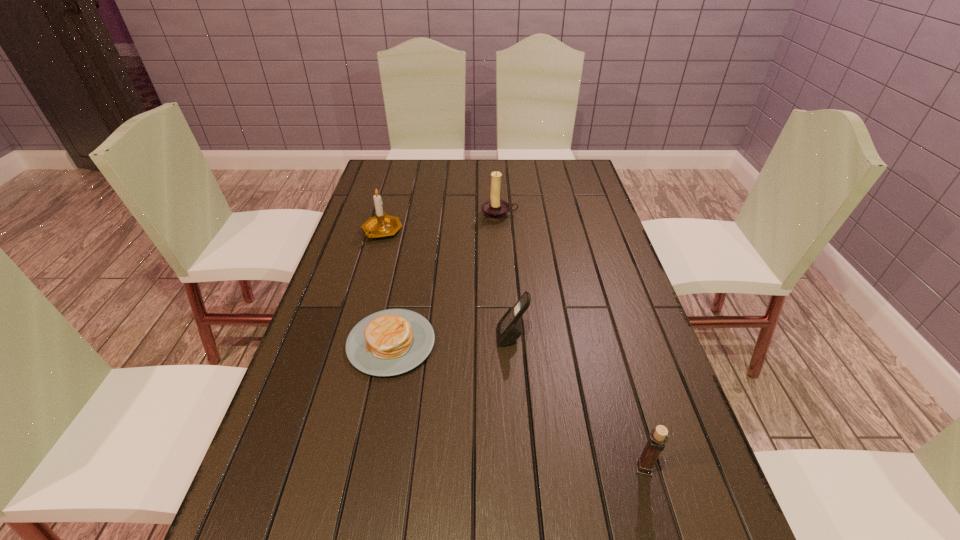
Where is `free area in between the cellular telephone and the rightmost candle holder`? The image size is (960, 540). free area in between the cellular telephone and the rightmost candle holder is located at coordinates (578, 402).

At what (x,y) coordinates should I click in order to perform the action: click on free spot between the shortest object and the rightmost candle holder. Please return your answer as a coordinate pair (x, y). Looking at the image, I should click on (517, 406).

At what (x,y) coordinates should I click in order to perform the action: click on empty space that is in between the second candle holder from left to right and the nearest object. Please return your answer as a coordinate pair (x, y). Looking at the image, I should click on coord(571,341).

Image resolution: width=960 pixels, height=540 pixels. I want to click on vacant space that is in between the pancake and the nearest object, so click(517, 406).

Image resolution: width=960 pixels, height=540 pixels. In order to click on free space between the pancake and the leftmost candle holder in this screenshot , I will do `click(387, 287)`.

Image resolution: width=960 pixels, height=540 pixels. In order to click on free space between the leftmost candle holder and the rightmost object in this screenshot , I will do `click(513, 350)`.

Choose which object is the fourth nearest neighbor to the cellular telephone. Please provide its 2D coordinates. Your answer should be formatted as a tuple, i.e. [(x, y)], where the tuple contains the x and y coordinates of a point satisfying the conditions above.

[(494, 209)]

Identify the location of object that is the third closest to the shortest object. The height and width of the screenshot is (540, 960). (494, 209).

Find the location of `candle holder that can be found as the closest to the rightmost object`. candle holder that can be found as the closest to the rightmost object is located at coordinates (494, 209).

Identify which candle holder is the second closest to the rightmost object. Please provide its 2D coordinates. Your answer should be formatted as a tuple, i.e. [(x, y)], where the tuple contains the x and y coordinates of a point satisfying the conditions above.

[(381, 225)]